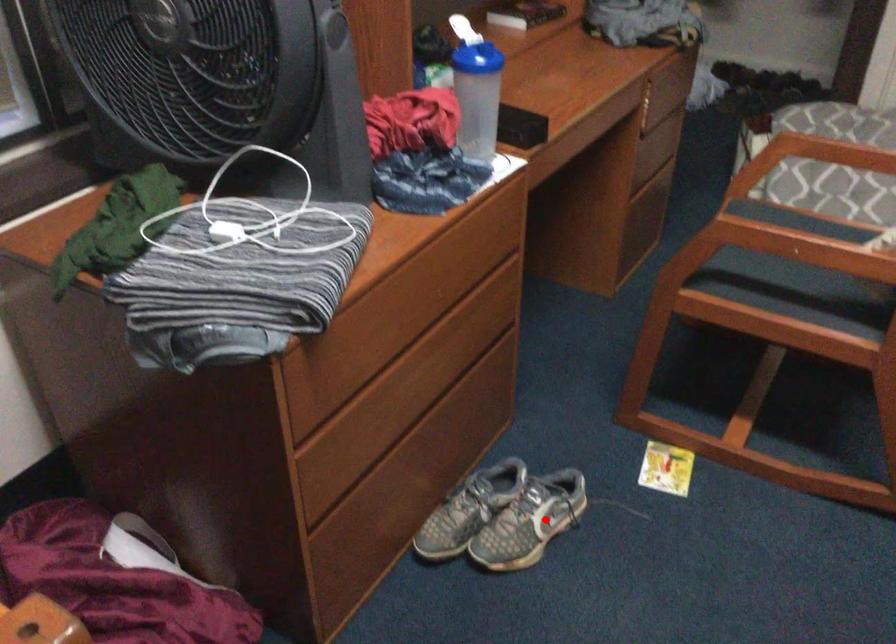
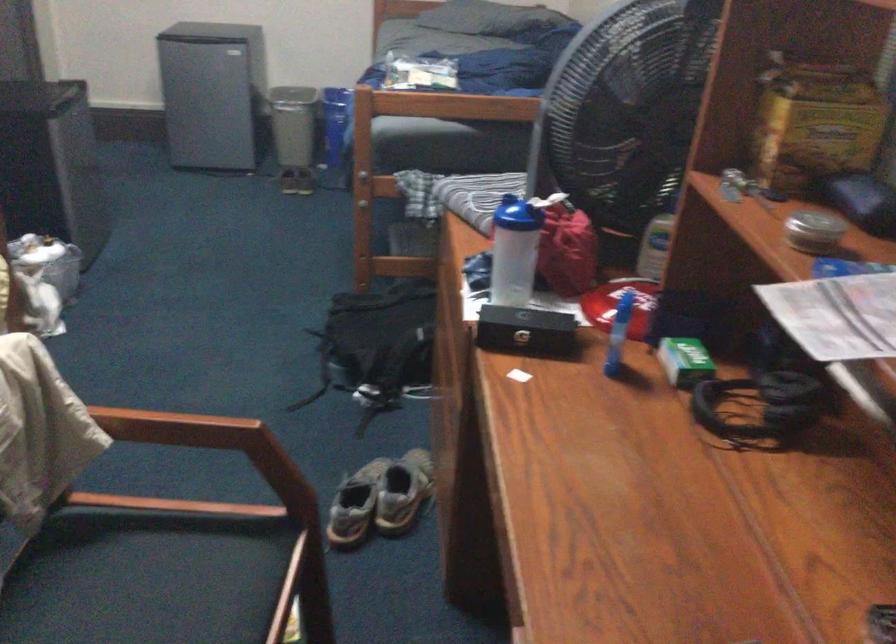
Question: I am providing you with two images of the same scene from different viewpoints. In image1, a red point is highlighted. Considering the same 3D point in image2, which of the following is correct?

Choices:
 (A) It is closer
 (B) It is farther

Answer: (B)